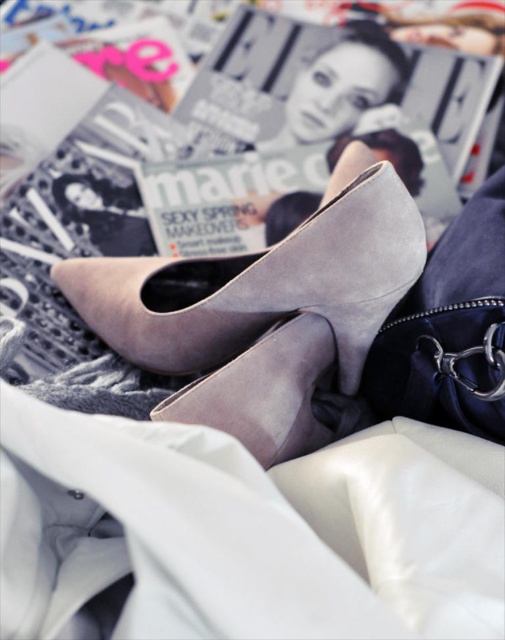
You are a photographer setting up a shoot. You need to place a small prop exactly halfway between the suede gray shoe at center and the edge of the image. Where should you position the prop?

The suede gray shoe at center is located at point [273,394]. To find the halfway point between it and the edge of the image, you would calculate the midpoint between the shoe and the nearest edge, ensuring the prop is placed equidistant from both.